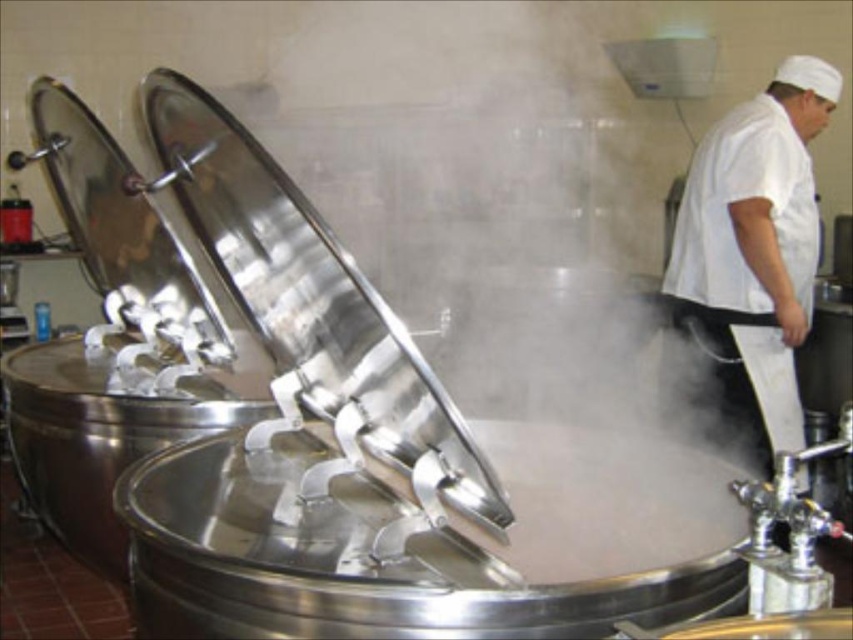
Question: Considering the relative positions of polished stainless steel exhaust hood at center and white matte chef hat at upper right in the image provided, where is polished stainless steel exhaust hood at center located with respect to white matte chef hat at upper right?

Choices:
 (A) left
 (B) right

Answer: (A)

Question: Which object appears closest to the camera in this image?

Choices:
 (A) polished stainless steel exhaust hood at center
 (B) white matte chef hat at upper right

Answer: (A)

Question: Is polished stainless steel exhaust hood at center bigger than white matte chef hat at upper right?

Choices:
 (A) no
 (B) yes

Answer: (B)

Question: Which point appears closest to the camera in this image?

Choices:
 (A) (798, 259)
 (B) (305, 220)

Answer: (B)

Question: Which point is closer to the camera?

Choices:
 (A) (744, 301)
 (B) (235, 198)

Answer: (B)

Question: Does polished stainless steel exhaust hood at center appear on the left side of white matte chef hat at upper right?

Choices:
 (A) yes
 (B) no

Answer: (A)